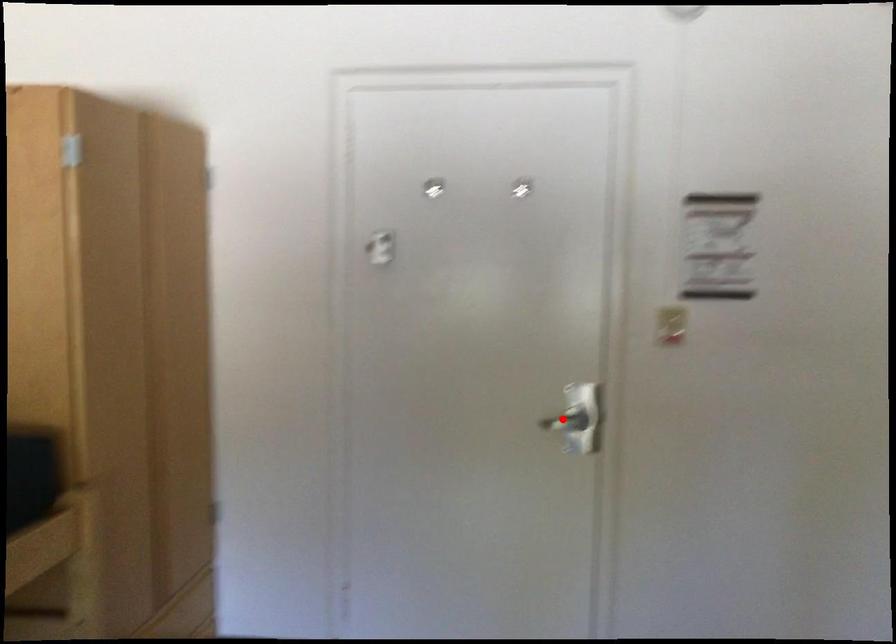
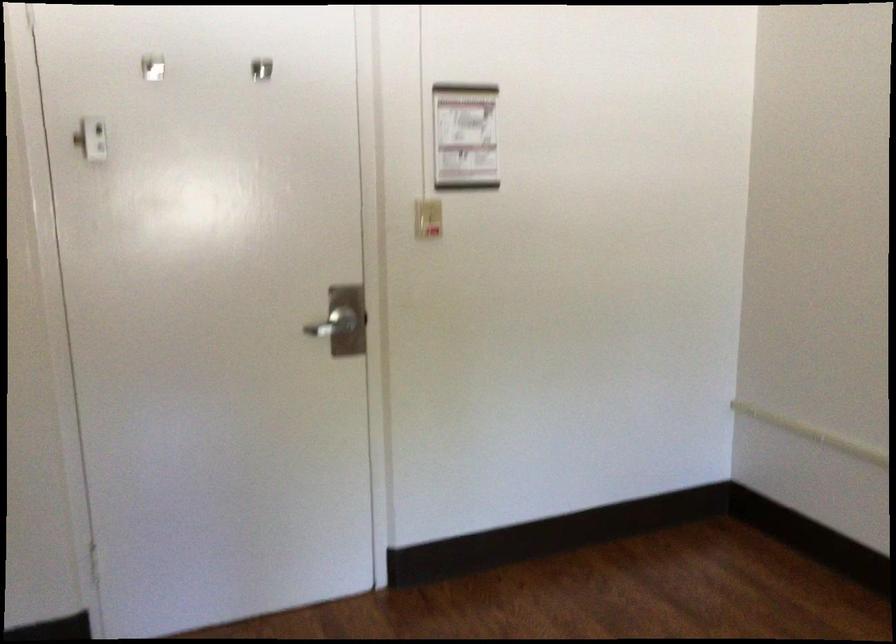
Find the pixel in the second image that matches the highlighted location in the first image.

(330, 323)